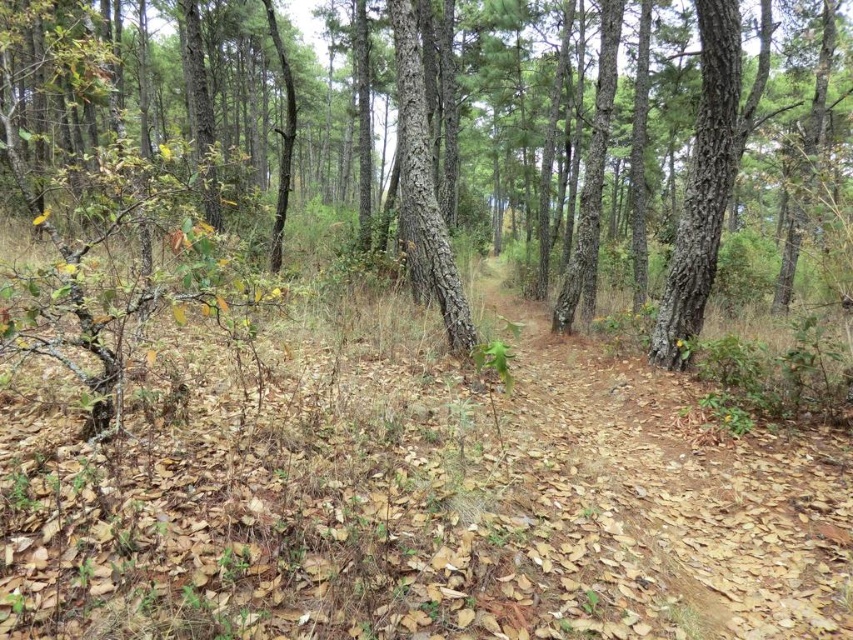
Is point (54, 349) farther from viewer compared to point (724, 132)?

No, it is in front of (724, 132).

Between brown rough tree at center and smooth bark tree at right, which one has more height?

With more height is brown rough tree at center.

Does point (547, 285) lie behind point (718, 218)?

Yes.

Find the location of `brown rough tree at center`. brown rough tree at center is located at coordinates (74, 184).

In the scene shown: Does smooth bark tree at right have a lesser width compared to smooth bark tree at center?

Correct, smooth bark tree at right's width is less than smooth bark tree at center's.

Can you confirm if smooth bark tree at right is bigger than smooth bark tree at center?

Incorrect, smooth bark tree at right is not larger than smooth bark tree at center.

The image size is (853, 640). Find the location of `smooth bark tree at right`. smooth bark tree at right is located at coordinates click(x=701, y=186).

In the scene shown: Can you confirm if brown rough tree at center is positioned to the left of smooth bark tree at center?

Indeed, brown rough tree at center is positioned on the left side of smooth bark tree at center.

From the picture: Can you confirm if brown rough tree at center is wider than smooth bark tree at center?

Yes, brown rough tree at center is wider than smooth bark tree at center.

Who is more distant from viewer, (x=521, y=20) or (x=440, y=230)?

Point (x=521, y=20)

At what (x,y) coordinates should I click in order to perform the action: click on brown rough tree at center. Please return your answer as a coordinate pair (x, y). This screenshot has width=853, height=640. Looking at the image, I should click on pos(74,184).